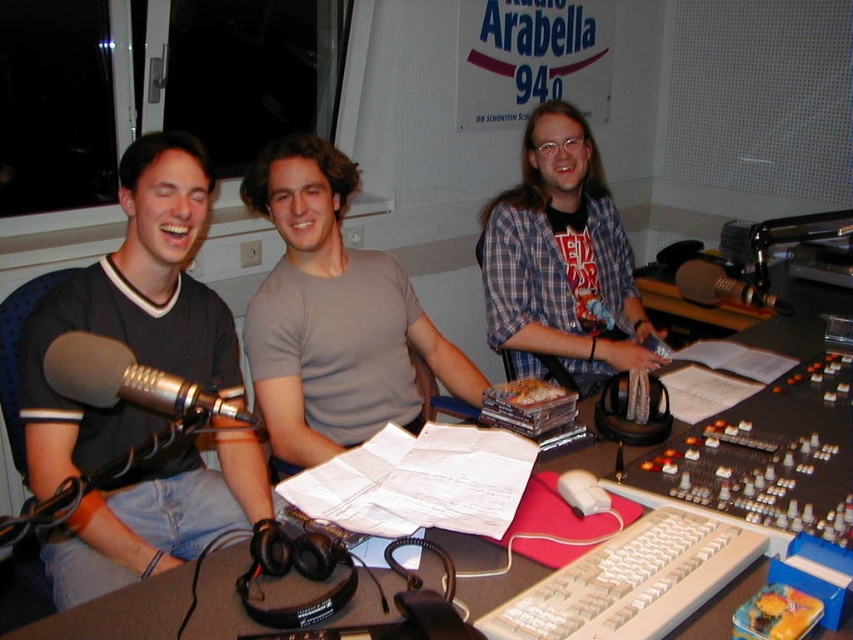
Can you confirm if silver metallic microphone at left is thinner than metallic silver microphone at center right?

Correct, silver metallic microphone at left's width is less than metallic silver microphone at center right's.

Between silver metallic microphone at left and metallic silver microphone at center right, which one is positioned higher?

metallic silver microphone at center right is above.

Who is more forward, (x=125, y=372) or (x=689, y=289)?

Point (x=125, y=372)

Find the location of a particular element. This screenshot has width=853, height=640. silver metallic microphone at left is located at coordinates (134, 381).

Can you confirm if white plastic table at center is positioned above silver metallic microphone at left?

Yes.

Between point (187, 634) and point (230, 412), which one is positioned behind?

The point (187, 634) is behind.

What do you see at coordinates (119, 612) in the screenshot? I see `white plastic table at center` at bounding box center [119, 612].

What are the coordinates of `white plastic table at center` in the screenshot? It's located at (119, 612).

The image size is (853, 640). Describe the element at coordinates (560, 259) in the screenshot. I see `plaid shirt at center` at that location.

Can you confirm if plaid shirt at center is thinner than metallic silver microphone at center right?

In fact, plaid shirt at center might be wider than metallic silver microphone at center right.

The width and height of the screenshot is (853, 640). What do you see at coordinates (560, 259) in the screenshot?
I see `plaid shirt at center` at bounding box center [560, 259].

This screenshot has width=853, height=640. I want to click on plaid shirt at center, so click(x=560, y=259).